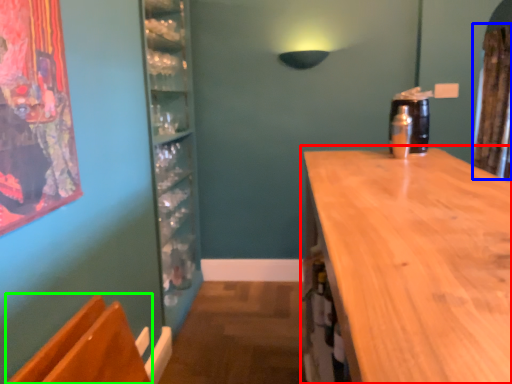
Question: Which object is positioned closest to countertop (highlighted by a red box)? Select from curtain (highlighted by a blue box) and armchair (highlighted by a green box).

Choices:
 (A) curtain
 (B) armchair

Answer: (B)